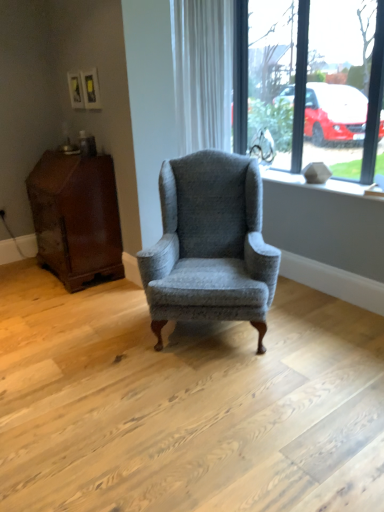
Where is `vacant area that is in front of textured gray wingback chair at center`? vacant area that is in front of textured gray wingback chair at center is located at coordinates (219, 399).